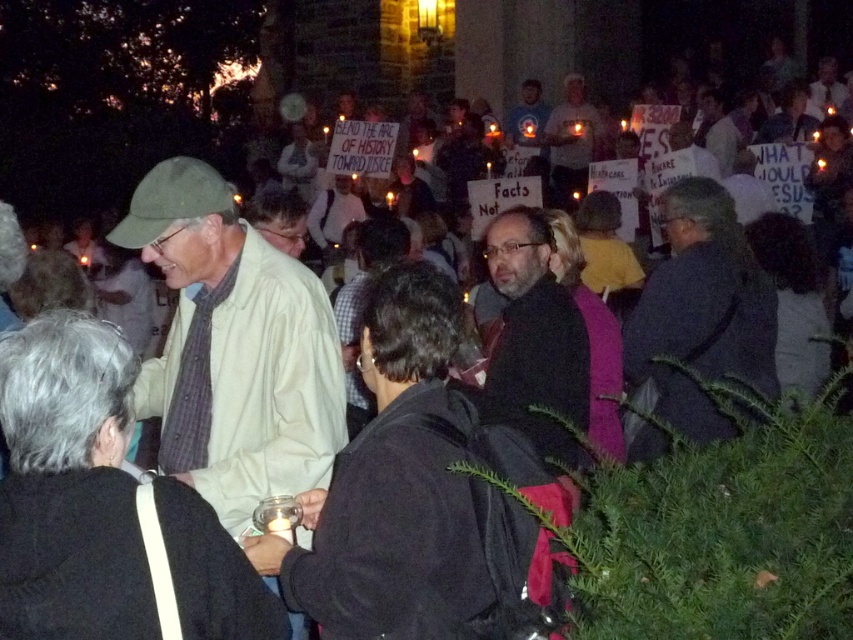
You are a photographer at the protest, and you want to capture both the dark brown leather jacket at center and the white shirt at center in the same frame. Which object should you focus on to ensure both are visible without zooming in or out?

You should focus on the dark brown leather jacket at center because it occupies less space than the white shirt at center, allowing both to fit within the frame without needing to adjust the zoom.